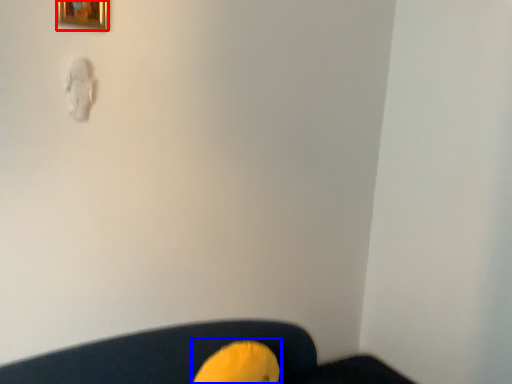
Question: Which point is closer to the camera, picture frame (highlighted by a red box) or bean bag chair (highlighted by a blue box)?

Choices:
 (A) picture frame
 (B) bean bag chair

Answer: (A)